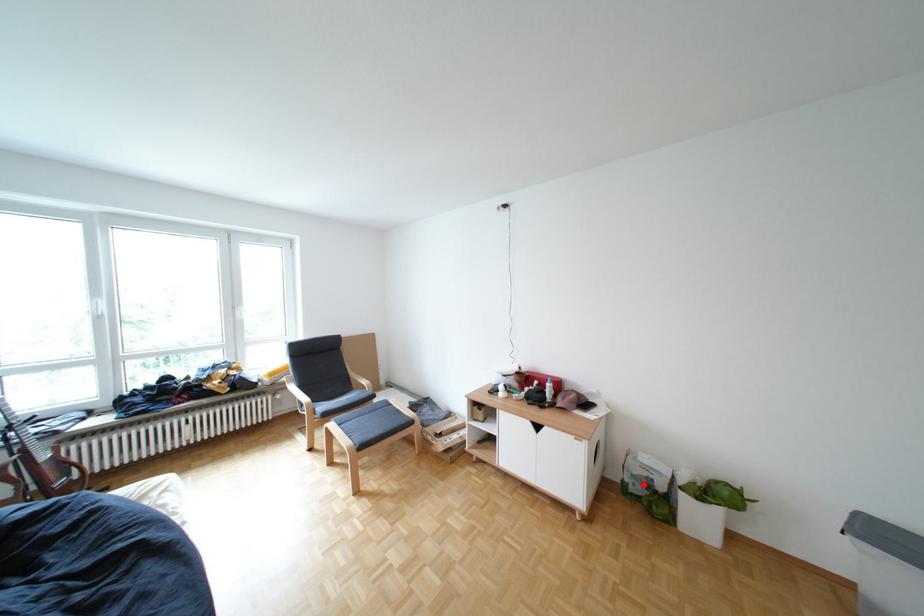
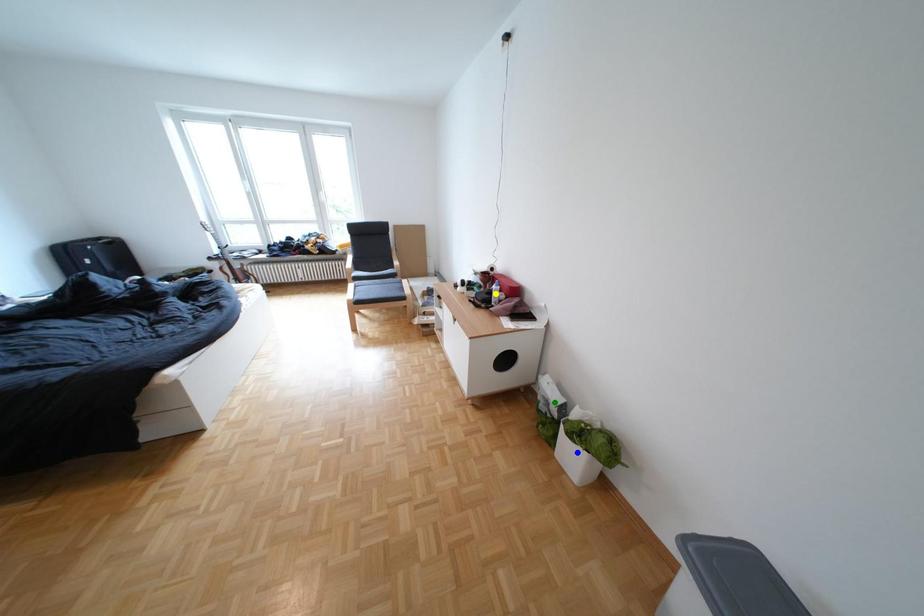
Question: I am providing you with two images of the same scene from different viewpoints. A red point is marked on the first image. You are given multiple points on the second image. In image 2, which mark is for the same physical point as the one in image 1?

Choices:
 (A) green point
 (B) blue point
 (C) yellow point

Answer: (A)